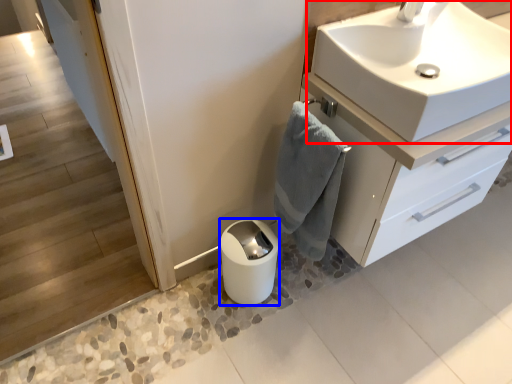
Question: Which object is further to the camera taking this photo, sink (highlighted by a red box) or toilet paper (highlighted by a blue box)?

Choices:
 (A) sink
 (B) toilet paper

Answer: (B)